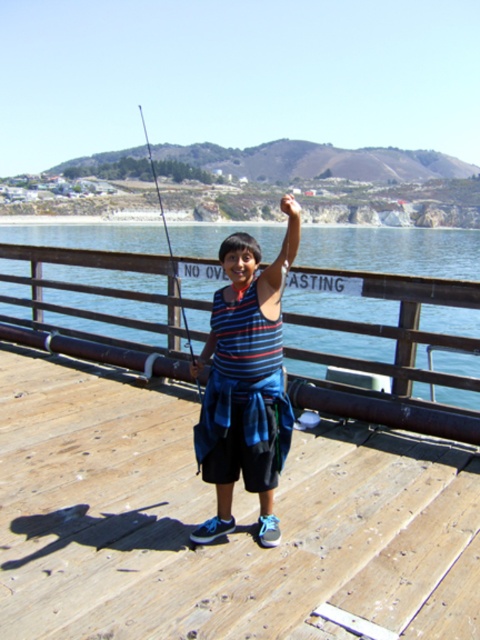
Question: Can you confirm if wooden dock at center is wider than striped fabric shirt at center?

Choices:
 (A) no
 (B) yes

Answer: (B)

Question: Considering the relative positions of wooden dock at center and striped fabric shirt at center in the image provided, where is wooden dock at center located with respect to striped fabric shirt at center?

Choices:
 (A) right
 (B) left

Answer: (B)

Question: Which point is closer to the camera?

Choices:
 (A) matte black fishing rod at center
 (B) wooden dock at center
 (C) clear blue water at center

Answer: (B)

Question: Can you confirm if wooden dock at center is wider than clear blue water at center?

Choices:
 (A) yes
 (B) no

Answer: (B)

Question: Considering the real-world distances, which object is closest to the wooden dock at center?

Choices:
 (A) striped fabric shirt at center
 (B) matte black fishing rod at center
 (C) clear blue water at center

Answer: (A)

Question: Estimate the real-world distances between objects in this image. Which object is farther from the striped fabric shirt at center?

Choices:
 (A) matte black fishing rod at center
 (B) clear blue water at center
 (C) wooden dock at center

Answer: (B)